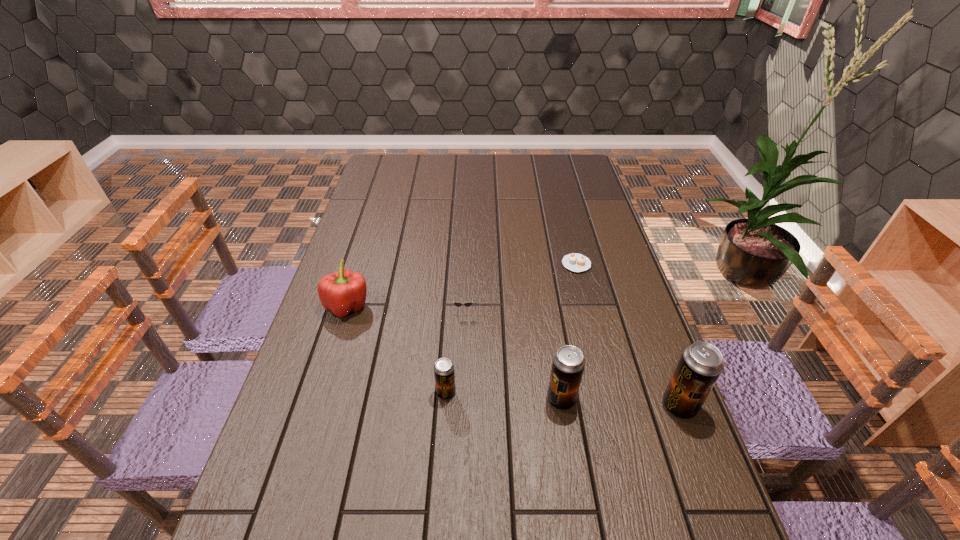
In order to click on vacant region between the fourth object from left to right and the bell pepper in this screenshot , I will do `click(454, 353)`.

At what (x,y) coordinates should I click in order to perform the action: click on free space between the second shortest beer can and the second shortest object. Please return your answer as a coordinate pair (x, y). Looking at the image, I should click on (513, 354).

Locate an element on the screen. The width and height of the screenshot is (960, 540). object that stands as the third closest to the rightmost object is located at coordinates (458, 304).

Select which object is the third closest to the rightmost object. Please provide its 2D coordinates. Your answer should be formatted as a tuple, i.e. [(x, y)], where the tuple contains the x and y coordinates of a point satisfying the conditions above.

[(458, 304)]

Point out which beer can is positioned as the second nearest to the second beer can from right to left. Please provide its 2D coordinates. Your answer should be formatted as a tuple, i.e. [(x, y)], where the tuple contains the x and y coordinates of a point satisfying the conditions above.

[(444, 374)]

Point out which beer can is positioned as the second nearest to the rightmost beer can. Please provide its 2D coordinates. Your answer should be formatted as a tuple, i.e. [(x, y)], where the tuple contains the x and y coordinates of a point satisfying the conditions above.

[(444, 374)]

Where is `free location that satisfies the following two spatial constraints: 1. on the front side of the fourth object from left to right; 2. on the right side of the shortest beer can`? free location that satisfies the following two spatial constraints: 1. on the front side of the fourth object from left to right; 2. on the right side of the shortest beer can is located at coordinates (445, 400).

Image resolution: width=960 pixels, height=540 pixels. In order to click on vacant region that satisfies the following two spatial constraints: 1. in front of the lenses of the fifth tallest object; 2. on the left side of the rightmost beer can in this screenshot , I will do `click(460, 406)`.

Identify the location of vacant space that satisfies the following two spatial constraints: 1. on the front side of the rightmost object; 2. on the left side of the shortest beer can. This screenshot has height=540, width=960. (445, 406).